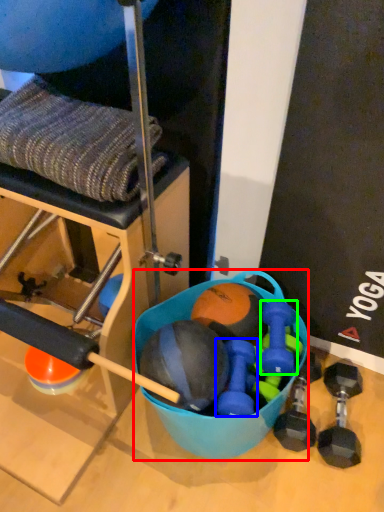
Question: Considering the real-world distances, which object is farthest from bowl (highlighted by a red box)? dumbbell (highlighted by a blue box) or dumbbell (highlighted by a green box)?

Choices:
 (A) dumbbell
 (B) dumbbell

Answer: (B)